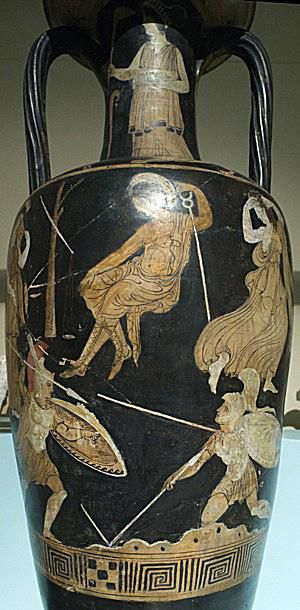
Identify the location of vase handle. The image size is (300, 610). (257, 138), (37, 84).